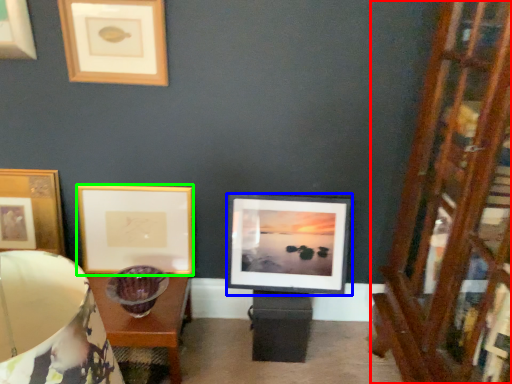
Question: Considering the real-world distances, which object is closest to dresser (highlighted by a red box)? picture frame (highlighted by a blue box) or picture frame (highlighted by a green box).

Choices:
 (A) picture frame
 (B) picture frame

Answer: (A)